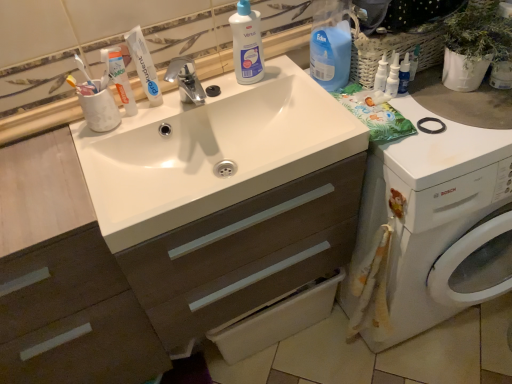
Where is `free space to the left of white glossy toothpaste tube at upper left`? free space to the left of white glossy toothpaste tube at upper left is located at coordinates (57, 144).